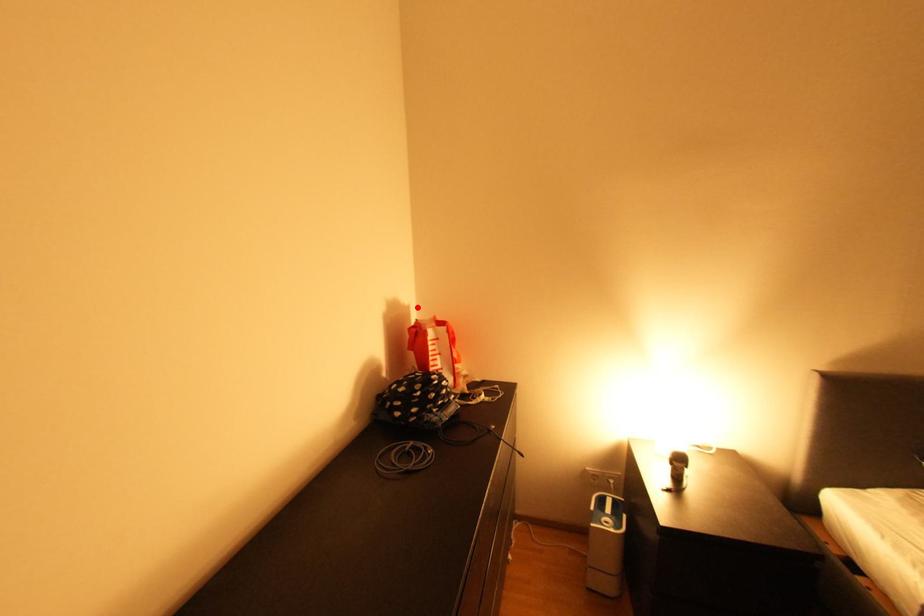
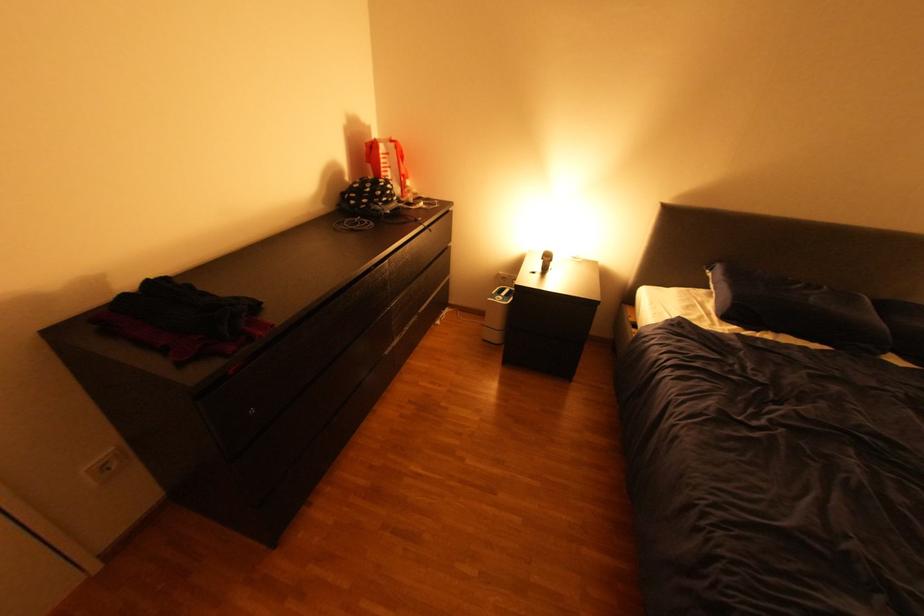
The point at the highlighted location is marked in the first image. Where is the corresponding point in the second image?

(379, 129)